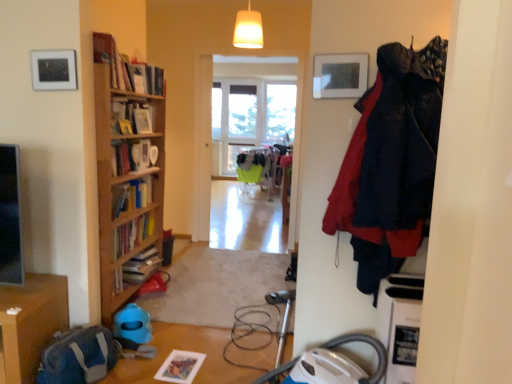
Question: Considering the relative sizes of white glossy bookshelf at upper left and clear glass window at center, the 1th window from the left, in the image provided, is white glossy bookshelf at upper left wider than clear glass window at center, the 1th window from the left,?

Choices:
 (A) yes
 (B) no

Answer: (B)

Question: From a real-world perspective, is white glossy bookshelf at upper left under clear glass window at center, which ranks as the 2th window in right-to-left order?

Choices:
 (A) yes
 (B) no

Answer: (A)

Question: Considering the relative positions of white glossy bookshelf at upper left and clear glass window at center, the 1th window from the left, in the image provided, is white glossy bookshelf at upper left to the left of clear glass window at center, the 1th window from the left, from the viewer's perspective?

Choices:
 (A) no
 (B) yes

Answer: (B)

Question: Could you tell me if white glossy bookshelf at upper left is turned towards clear glass window at center, the 1th window from the left?

Choices:
 (A) yes
 (B) no

Answer: (B)

Question: Is white glossy bookshelf at upper left completely or partially outside of clear glass window at center, which ranks as the 2th window in right-to-left order?

Choices:
 (A) no
 (B) yes

Answer: (B)

Question: Considering their positions, is transparent glass window at center, the 2th window positioned from the left, located in front of or behind matte white picture frame at upper left?

Choices:
 (A) front
 (B) behind

Answer: (B)

Question: From a real-world perspective, is transparent glass window at center, the 2th window positioned from the left, above or below matte white picture frame at upper left?

Choices:
 (A) above
 (B) below

Answer: (B)

Question: Is transparent glass window at center, the 2th window positioned from the left, inside the boundaries of matte white picture frame at upper left, or outside?

Choices:
 (A) inside
 (B) outside

Answer: (B)

Question: Is point (272, 100) closer or farther from the camera than point (53, 49)?

Choices:
 (A) closer
 (B) farther

Answer: (B)

Question: From the image's perspective, is wooden table at lower left above or below clear glass window at center, the 1th window from the left?

Choices:
 (A) below
 (B) above

Answer: (A)

Question: In terms of width, does wooden table at lower left look wider or thinner when compared to clear glass window at center, which ranks as the 2th window in right-to-left order?

Choices:
 (A) wide
 (B) thin

Answer: (A)

Question: From a real-world perspective, is wooden table at lower left positioned above or below clear glass window at center, the 1th window from the left?

Choices:
 (A) below
 (B) above

Answer: (A)

Question: Is wooden table at lower left in front of or behind clear glass window at center, which ranks as the 2th window in right-to-left order, in the image?

Choices:
 (A) front
 (B) behind

Answer: (A)

Question: From the image's perspective, relative to matte white picture frame at upper left, is white glossy bookshelf at upper left above or below?

Choices:
 (A) below
 (B) above

Answer: (A)

Question: From a real-world perspective, is white glossy bookshelf at upper left above or below matte white picture frame at upper left?

Choices:
 (A) above
 (B) below

Answer: (B)